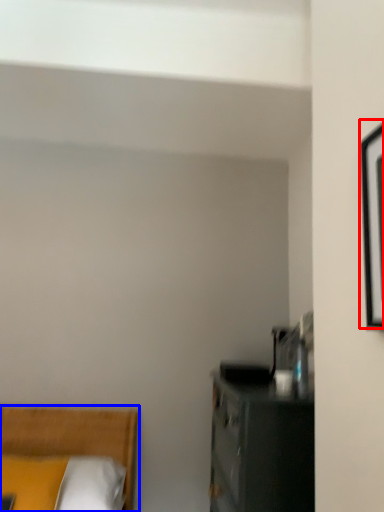
Question: Which object is further to the camera taking this photo, picture frame (highlighted by a red box) or bed (highlighted by a blue box)?

Choices:
 (A) picture frame
 (B) bed

Answer: (B)